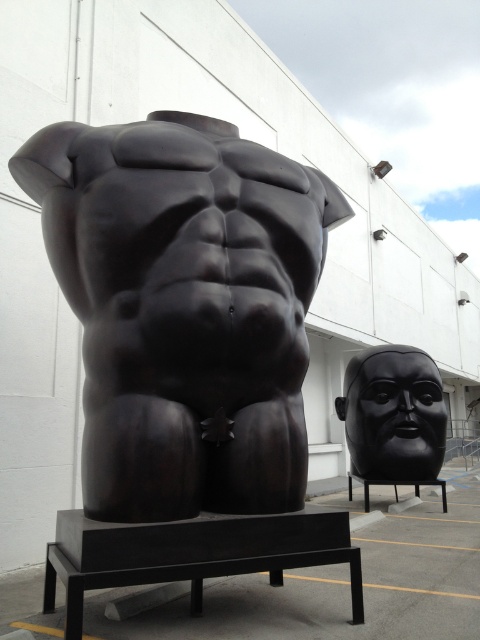
Can you confirm if glossy black torso at center is smaller than black glossy mask at right?

Actually, glossy black torso at center might be larger than black glossy mask at right.

Is glossy black torso at center in front of black glossy mask at right?

That is True.

Between point (130, 435) and point (388, 372), which one is positioned in front?

Point (130, 435) is more forward.

Locate an element on the screen. The width and height of the screenshot is (480, 640). glossy black torso at center is located at coordinates (184, 308).

Is matte black bench at center positioned at the back of black metal bench at lower right?

No, it is not.

The image size is (480, 640). In order to click on matte black bench at center in this screenshot , I will do `click(192, 554)`.

Is point (145, 582) less distant than point (377, 481)?

Yes, point (145, 582) is closer to viewer.

Locate an element on the screen. This screenshot has height=640, width=480. matte black bench at center is located at coordinates (192, 554).

Can you confirm if black glossy mask at right is thinner than black metal bench at lower right?

No, black glossy mask at right is not thinner than black metal bench at lower right.

In the scene shown: Does black glossy mask at right have a greater width compared to black metal bench at lower right?

Correct, the width of black glossy mask at right exceeds that of black metal bench at lower right.

Describe the element at coordinates (394, 413) in the screenshot. The image size is (480, 640). I see `black glossy mask at right` at that location.

What are the coordinates of `black glossy mask at right` in the screenshot? It's located at (394, 413).